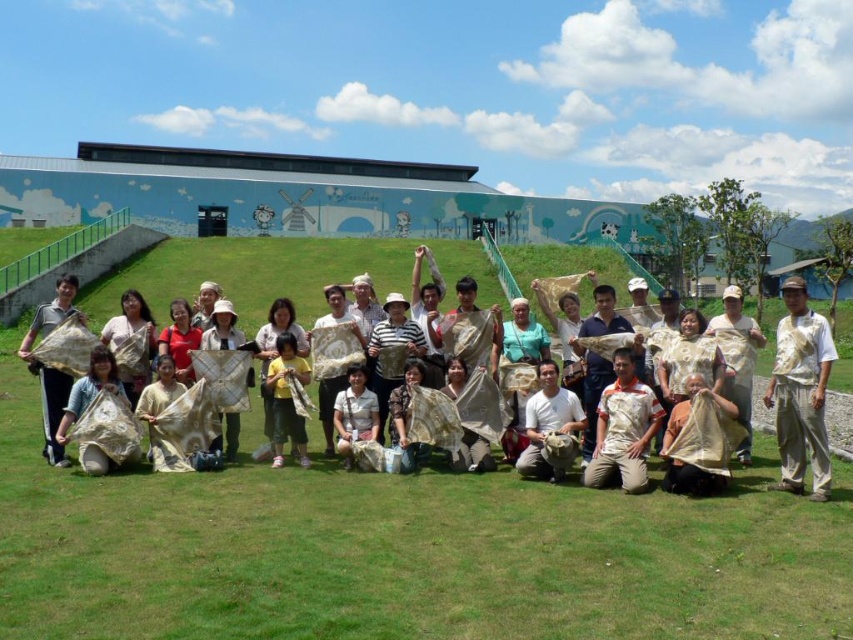
Based on the photo, you are a photographer taking a picture of the beige fabric bag at lower center and the white matte shirt at center. Which object should you focus on first if you want to ensure both are in focus, considering their sizes?

The beige fabric bag at lower center is taller than the white matte shirt at center, so focusing on the larger object first would help ensure both are in focus.

You are standing at the edge of the grassy area and want to reach the white matte shirt at center without stepping on any of the handmade items held by the group. The beige fabric bag at lower center is blocking your path. Can you walk around it? Explain your reasoning based on the distance between them.

The beige fabric bag at lower center is 22.62 feet away from the white matte shirt at center. Since the distance is quite large, you can easily walk around the beige fabric bag at lower center to reach the white matte shirt at center without stepping on any items.